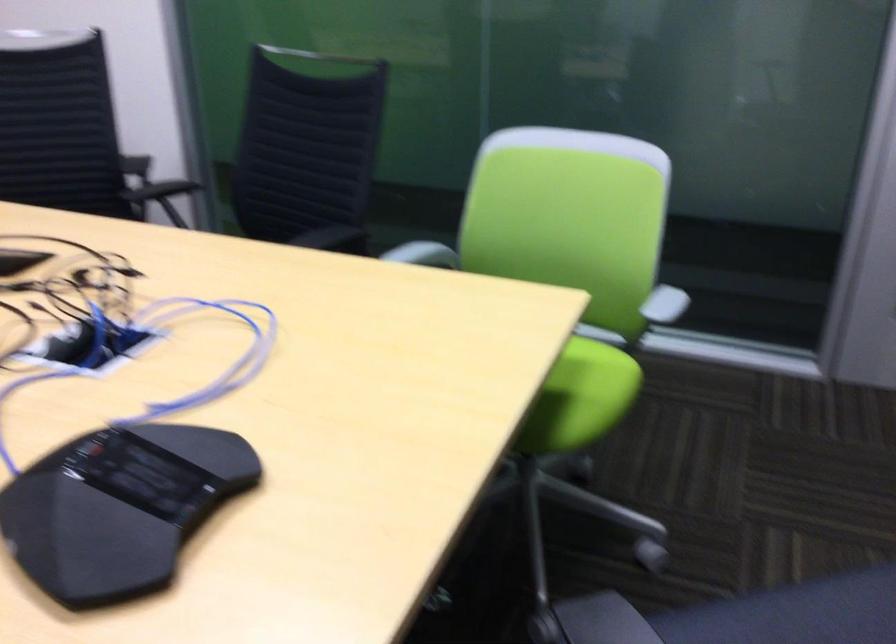
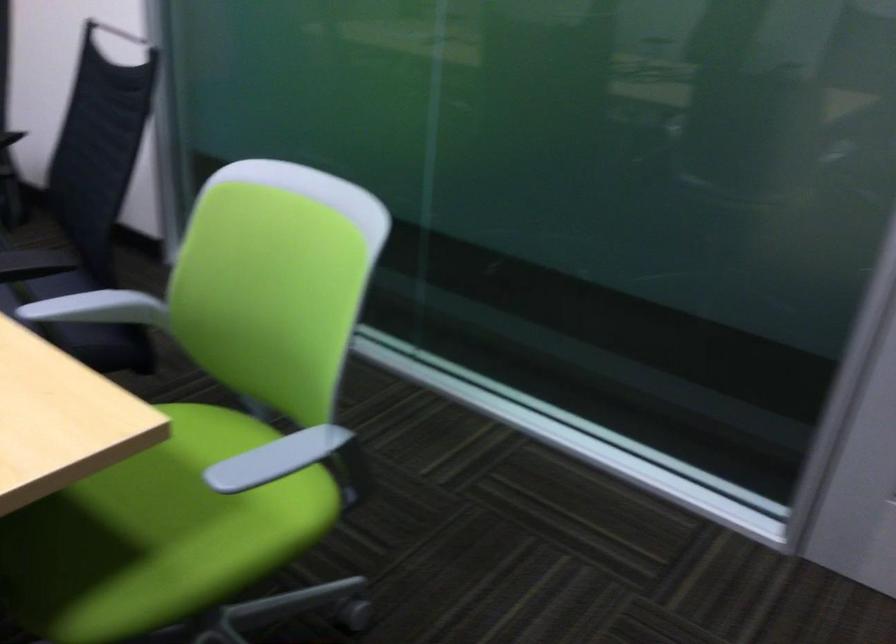
The point at (418, 256) is marked in the first image. Where is the corresponding point in the second image?

(97, 308)